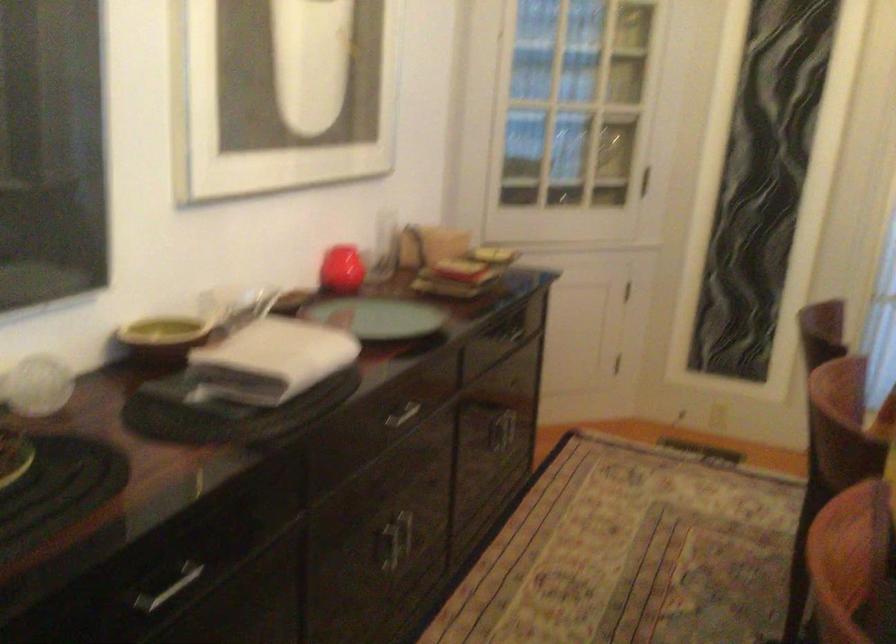
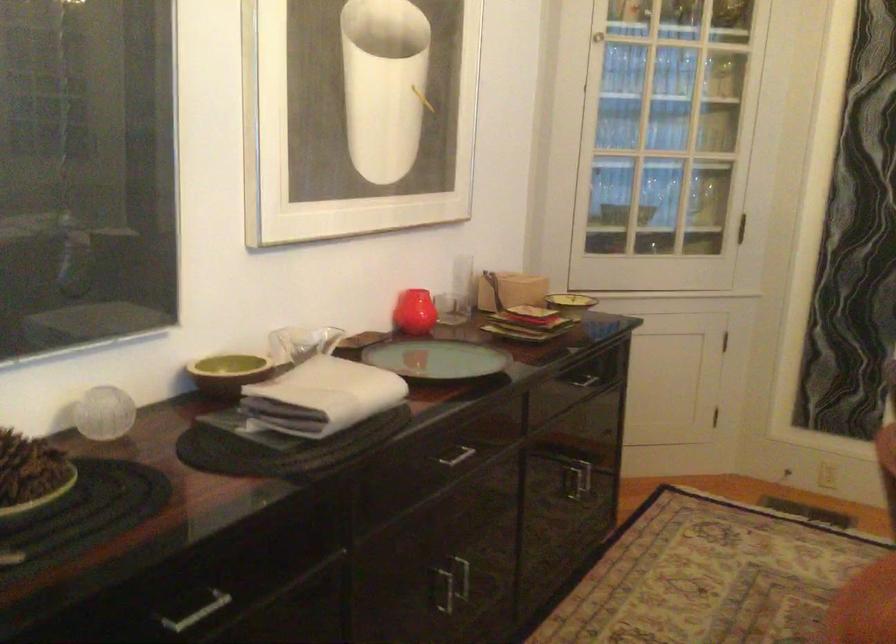
In the second image, find the point that corresponds to pixel 171 337 in the first image.

(228, 373)